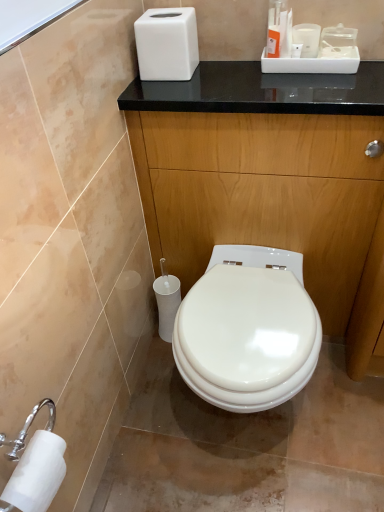
I want to click on empty space that is ontop of white glossy toilet at center, so click(245, 319).